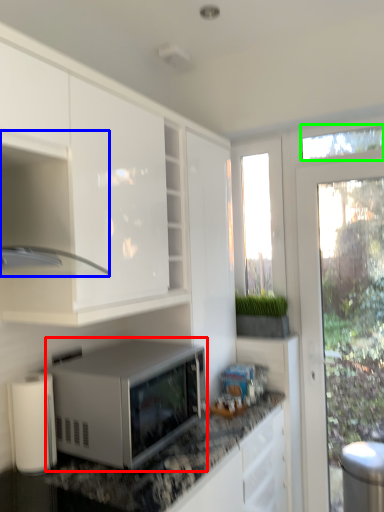
Question: Which object is the closest to the microwave oven (highlighted by a red box)? Choose among these: cabinetry (highlighted by a blue box) or window screen (highlighted by a green box).

Choices:
 (A) cabinetry
 (B) window screen

Answer: (A)